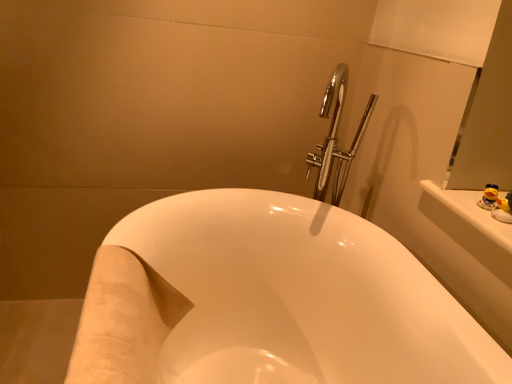
Question: Do you think white glossy bathtub at center is within yellow rubber duck at upper right, arranged as the 1th toy when viewed from the front, or outside of it?

Choices:
 (A) outside
 (B) inside

Answer: (A)

Question: Based on their positions, is white glossy bathtub at center located to the left or right of yellow rubber duck at upper right, which appears as the 2th toy when viewed from the back?

Choices:
 (A) right
 (B) left

Answer: (B)

Question: Which object is positioned closest to the white glossy bathtub at center?

Choices:
 (A) yellow rubber duck at upper right, the second toy positioned from the front
 (B) yellow rubber duck at upper right, which appears as the 2th toy when viewed from the back

Answer: (A)

Question: Considering the real-world distances, which object is closest to the yellow rubber duck at upper right, which is the 1th toy from back to front?

Choices:
 (A) yellow rubber duck at upper right, arranged as the 1th toy when viewed from the front
 (B) white glossy bathtub at center

Answer: (A)